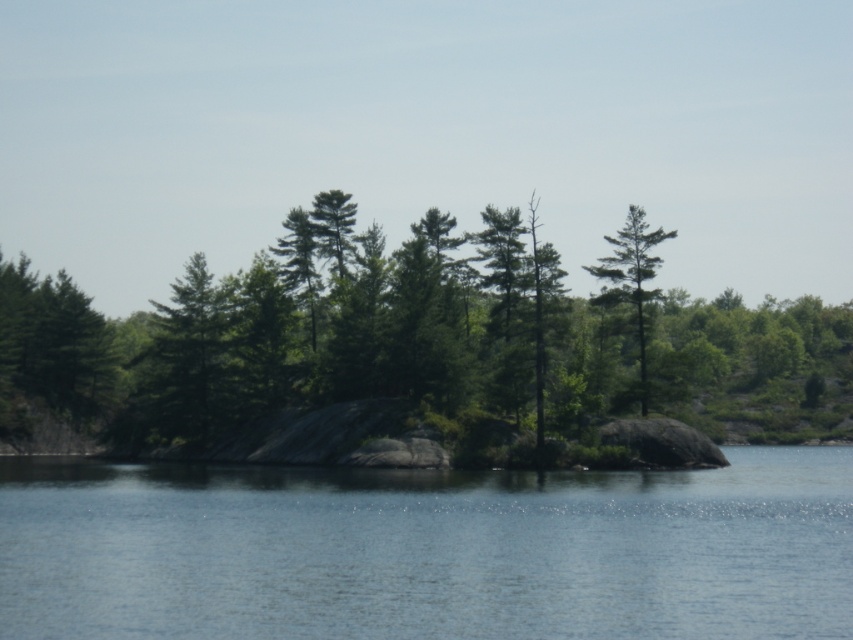
Question: Where is green matte tree at center located in relation to clear blue water at center in the image?

Choices:
 (A) above
 (B) below

Answer: (A)

Question: From the image, what is the correct spatial relationship of green matte tree at center in relation to clear blue water at center?

Choices:
 (A) above
 (B) below

Answer: (A)

Question: Which object appears farthest from the camera in this image?

Choices:
 (A) green matte tree at upper right
 (B) green matte tree at center
 (C) clear blue water at center

Answer: (A)

Question: Is clear blue water at center wider than green matte tree at upper right?

Choices:
 (A) no
 (B) yes

Answer: (B)

Question: Which point is farther to the camera?

Choices:
 (A) (633, 291)
 (B) (399, 416)
 (C) (747, 604)

Answer: (A)

Question: Which is farther from the clear blue water at center?

Choices:
 (A) green matte tree at upper right
 (B) green matte tree at center

Answer: (B)